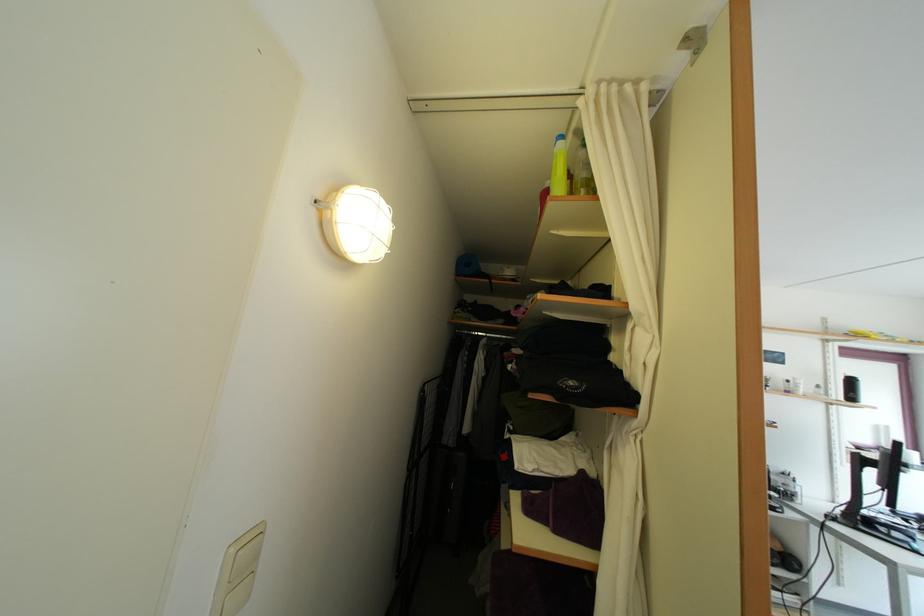
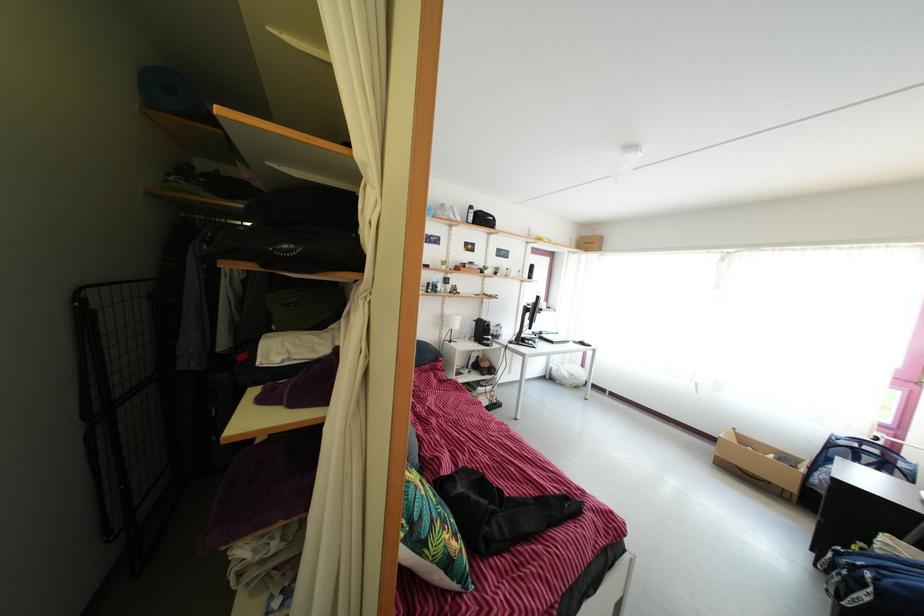
How did the camera likely rotate?

The rotation direction of the camera is right-down.